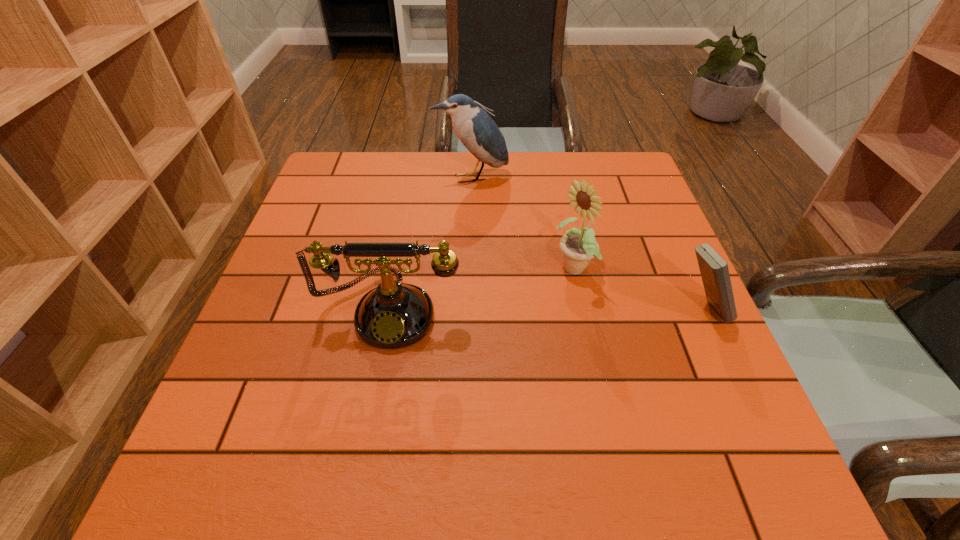
This screenshot has width=960, height=540. Find the location of `object identified as the second closest to the second shortest object`. object identified as the second closest to the second shortest object is located at coordinates (478, 132).

Where is `vacant space that satisfies the following two spatial constraints: 1. on the dial of the third tallest object; 2. on the front-facing side of the calculator`? vacant space that satisfies the following two spatial constraints: 1. on the dial of the third tallest object; 2. on the front-facing side of the calculator is located at coordinates (392, 310).

The height and width of the screenshot is (540, 960). Identify the location of free point that satisfies the following two spatial constraints: 1. on the dial of the shortest object; 2. on the front-facing side of the telephone. (392, 310).

The image size is (960, 540). In order to click on vacant area in the image that satisfies the following two spatial constraints: 1. on the dial of the rightmost object; 2. on the front-facing side of the third tallest object in this screenshot , I will do `click(392, 310)`.

The image size is (960, 540). I want to click on vacant area in the image that satisfies the following two spatial constraints: 1. on the front side of the rightmost object; 2. on the front-facing side of the bird, so click(468, 310).

You are a GUI agent. You are given a task and a screenshot of the screen. Output one action in this format:
    pyautogui.click(x=<x>, y=<y>)
    Task: Click on the free space that satisfies the following two spatial constraints: 1. on the dial of the rightmost object; 2. on the front-facing side of the third tallest object
    The image size is (960, 540).
    Given the screenshot: What is the action you would take?
    pyautogui.click(x=392, y=310)